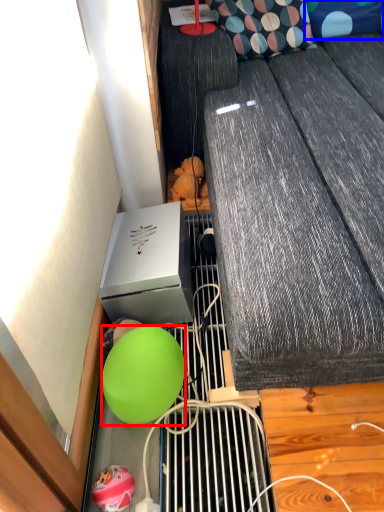
Question: Which object is closer to the camera taking this photo, ball (highlighted by a red box) or pillow (highlighted by a blue box)?

Choices:
 (A) ball
 (B) pillow

Answer: (A)